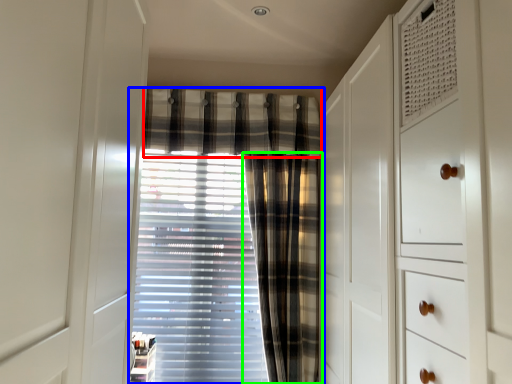
Question: Estimate the real-world distances between objects in this image. Which object is closer to plaid (highlighted by a red box), curtain (highlighted by a blue box) or curtain (highlighted by a green box)?

Choices:
 (A) curtain
 (B) curtain

Answer: (A)